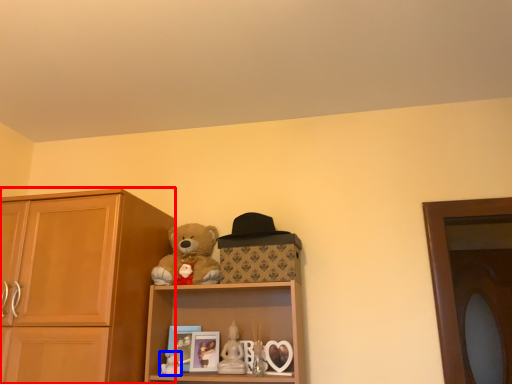
Question: Which of the following is the farthest to the observer, cabinetry (highlighted by a red box) or toy (highlighted by a blue box)?

Choices:
 (A) cabinetry
 (B) toy

Answer: (B)